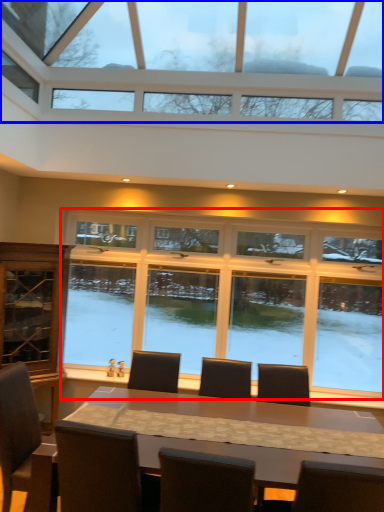
Question: Which point is further to the camera, window (highlighted by a red box) or window (highlighted by a blue box)?

Choices:
 (A) window
 (B) window

Answer: (A)